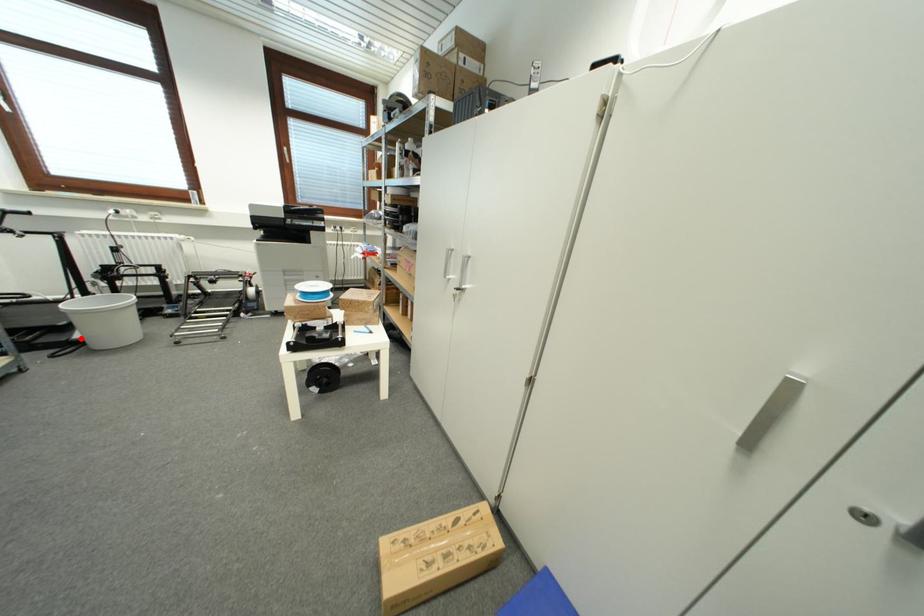
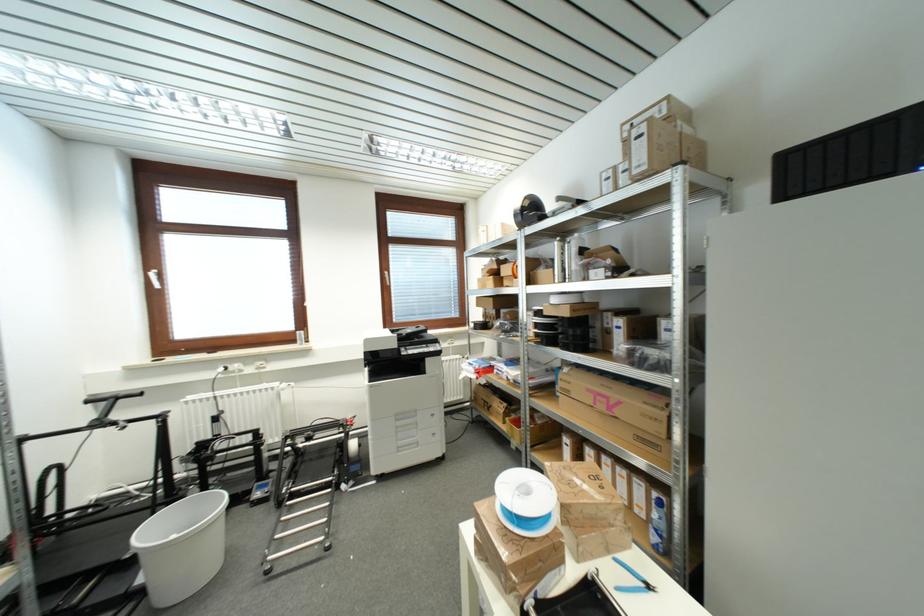
Question: A red point is marked in image1. In image2, is the corresponding 3D point closer to the camera or farther? Reply with the corresponding letter.

Choices:
 (A) The corresponding 3D point is closer.
 (B) The corresponding 3D point is farther.

Answer: (A)